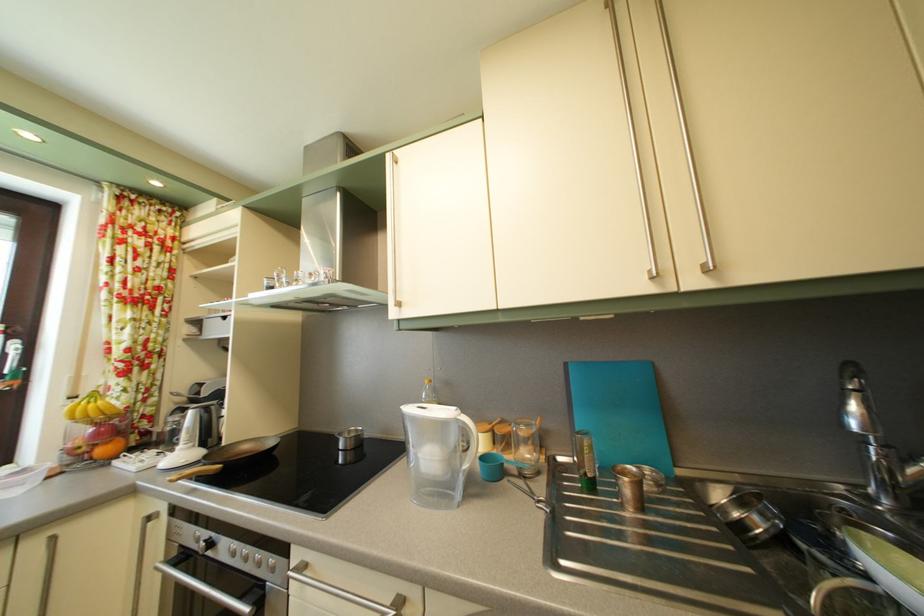
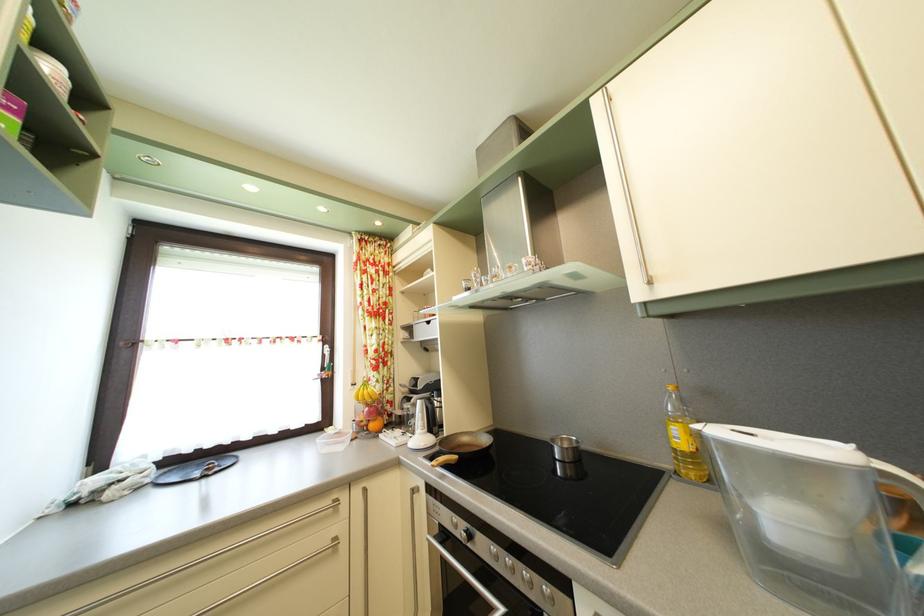
Locate, in the second image, the point that corresponds to the point at 456,391 in the first image.

(715, 400)